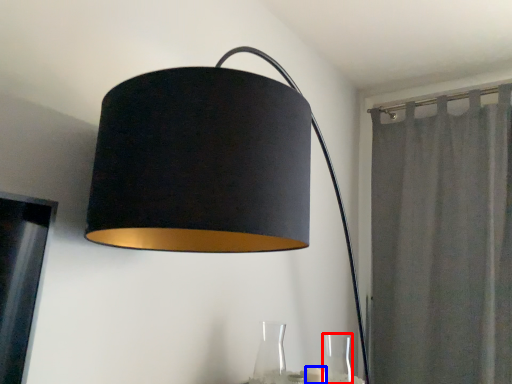
Question: Which of the following is the closest to the observer, glass vase (highlighted by a red box) or candle (highlighted by a blue box)?

Choices:
 (A) glass vase
 (B) candle

Answer: (A)